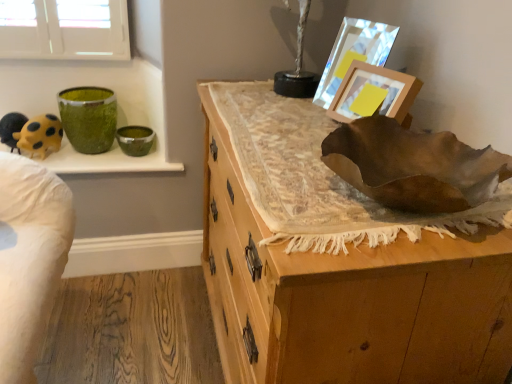
Question: Is wooden picture frame at upper right, the second picture frame from the back, shorter than metallic reflective picture frame at upper right, which is counted as the 1th picture frame, starting from the back?

Choices:
 (A) yes
 (B) no

Answer: (A)

Question: Is wooden picture frame at upper right, the first picture frame positioned from the front, oriented away from metallic reflective picture frame at upper right, which appears as the 2th picture frame when viewed from the front?

Choices:
 (A) yes
 (B) no

Answer: (B)

Question: Does wooden picture frame at upper right, the second picture frame from the back, have a smaller size compared to metallic reflective picture frame at upper right, which appears as the 2th picture frame when viewed from the front?

Choices:
 (A) no
 (B) yes

Answer: (B)

Question: From a real-world perspective, is wooden picture frame at upper right, the second picture frame from the back, over metallic reflective picture frame at upper right, which appears as the 2th picture frame when viewed from the front?

Choices:
 (A) yes
 (B) no

Answer: (B)

Question: Is wooden picture frame at upper right, the second picture frame from the back, wider than metallic reflective picture frame at upper right, which is counted as the 1th picture frame, starting from the back?

Choices:
 (A) yes
 (B) no

Answer: (B)

Question: From a real-world perspective, does wooden picture frame at upper right, the first picture frame positioned from the front, sit lower than metallic reflective picture frame at upper right, which is counted as the 1th picture frame, starting from the back?

Choices:
 (A) no
 (B) yes

Answer: (B)

Question: Is wooden chest of drawers at center to the left of metallic reflective picture frame at upper right, which appears as the 2th picture frame when viewed from the front, from the viewer's perspective?

Choices:
 (A) yes
 (B) no

Answer: (A)

Question: Is metallic reflective picture frame at upper right, which appears as the 2th picture frame when viewed from the front, completely or partially inside wooden chest of drawers at center?

Choices:
 (A) yes
 (B) no

Answer: (B)

Question: Is the surface of wooden chest of drawers at center in direct contact with metallic reflective picture frame at upper right, which appears as the 2th picture frame when viewed from the front?

Choices:
 (A) no
 (B) yes

Answer: (A)

Question: Can you confirm if wooden chest of drawers at center is positioned to the right of metallic reflective picture frame at upper right, which is counted as the 1th picture frame, starting from the back?

Choices:
 (A) yes
 (B) no

Answer: (B)

Question: Can you confirm if wooden chest of drawers at center is thinner than metallic reflective picture frame at upper right, which is counted as the 1th picture frame, starting from the back?

Choices:
 (A) yes
 (B) no

Answer: (B)

Question: Considering the relative sizes of wooden chest of drawers at center and metallic reflective picture frame at upper right, which appears as the 2th picture frame when viewed from the front, in the image provided, is wooden chest of drawers at center smaller than metallic reflective picture frame at upper right, which appears as the 2th picture frame when viewed from the front,?

Choices:
 (A) no
 (B) yes

Answer: (A)

Question: From the image's perspective, would you say green glossy bowl at upper left is positioned over yellow matte toy at upper left?

Choices:
 (A) yes
 (B) no

Answer: (B)